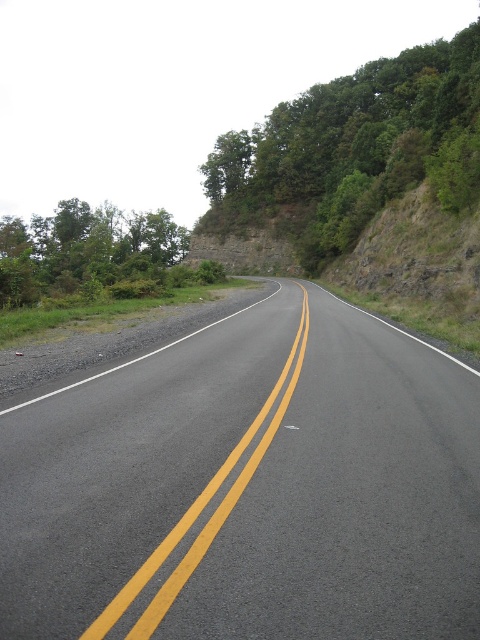
Question: Which of these objects is positioned farthest from the green leafy tree at upper center?

Choices:
 (A) green leafy trees at upper left
 (B) asphalt road at center
 (C) yellow asphalt road at center

Answer: (C)

Question: Which point is closer to the camera?

Choices:
 (A) green leafy tree at upper center
 (B) yellow asphalt road at center
 (C) asphalt road at center

Answer: (C)

Question: Can you confirm if green leafy tree at upper center is wider than yellow asphalt road at center?

Choices:
 (A) no
 (B) yes

Answer: (B)

Question: Does green leafy tree at upper center have a smaller size compared to green leafy trees at upper left?

Choices:
 (A) yes
 (B) no

Answer: (A)

Question: Considering the real-world distances, which object is farthest from the asphalt road at center?

Choices:
 (A) yellow asphalt road at center
 (B) green leafy tree at upper center

Answer: (B)

Question: Can you confirm if asphalt road at center is positioned below green leafy tree at upper center?

Choices:
 (A) no
 (B) yes

Answer: (B)